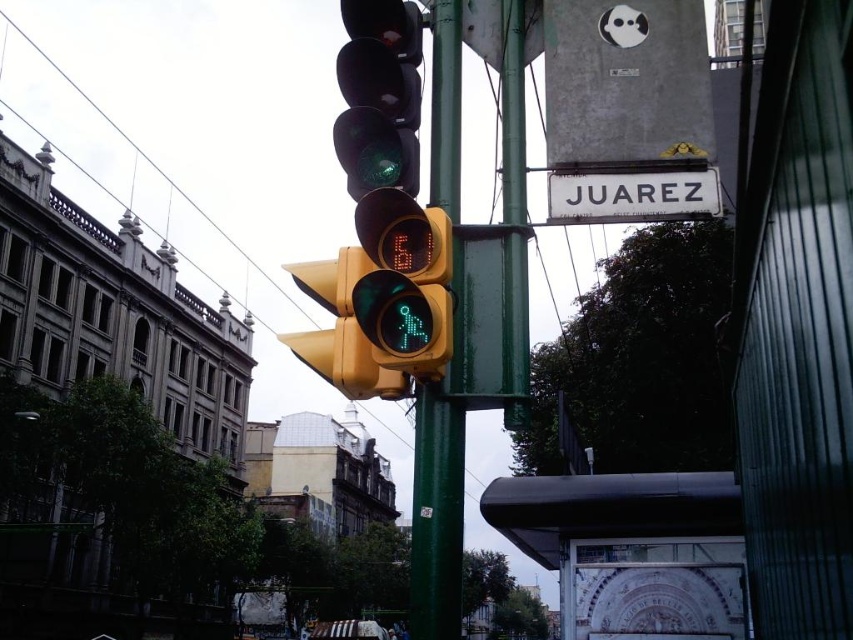
You are a city planner reviewing the urban street scene. You notice the yellow matte pedestrian signal at center and the metallic wire at upper left. Which object takes up more space in the image?

The metallic wire at upper left takes up more space than the yellow matte pedestrian signal at center.

You are a city planner assessing the street layout. You need to determine which object, the white plastic street sign at upper center or the metallic wire at upper left, has a smaller width. Which one is it?

The white plastic street sign at upper center is thinner than the metallic wire at upper left, so the white plastic street sign at upper center has a smaller width.